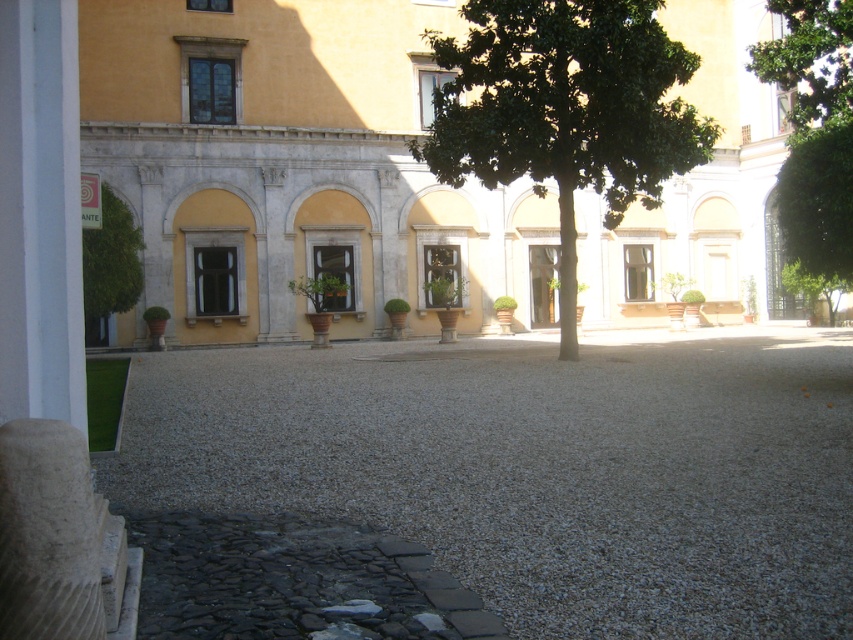
You are standing in the courtyard and want to take a photo of the yellow stone building at center. If your camera can focus on objects up to 30 meters away, will you be able to capture the building clearly?

The yellow stone building at center and camera are 31.43 meters apart, which exceeds the camera maximum focus distance of 30 meters. Therefore, the building will be out of focus and unclear in the photo.

You are a visitor standing in the courtyard and want to take a photo of the yellow stone building at center without any obstructions. Is the green leafy tree at upper right blocking your view of the building?

The green leafy tree at upper right is behind the yellow stone building at center, so it won t block your view of the building.

You are standing in the courtyard of a historical building and want to reach the point marked as point (798, 522). If you can walk 3 feet per second, how many seconds will it take you to reach that point?

The distance between you and point (798, 522) is 21.18 feet. At a walking speed of 3 feet per second, it will take 21.18 divided by 3, which is approximately 7.06 seconds to reach the point.